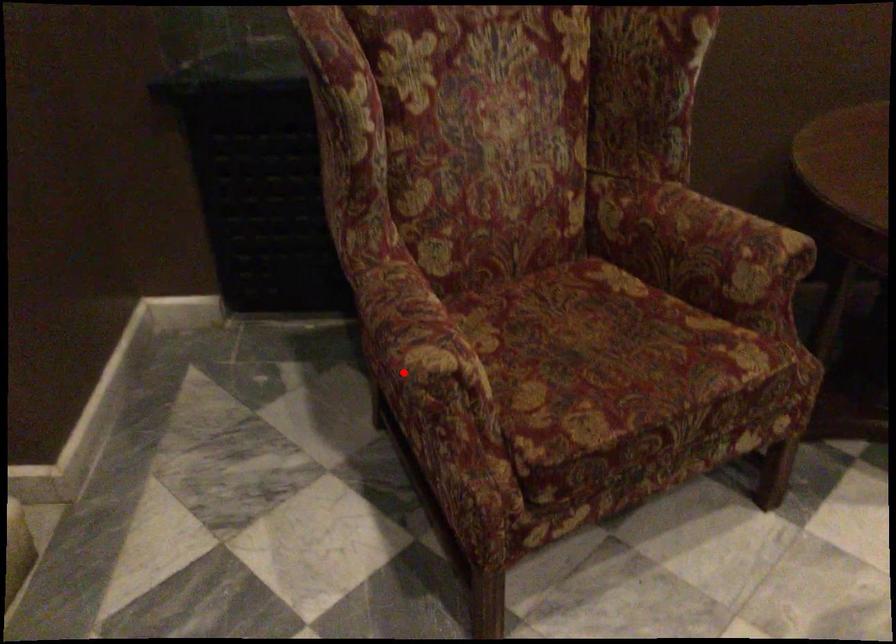
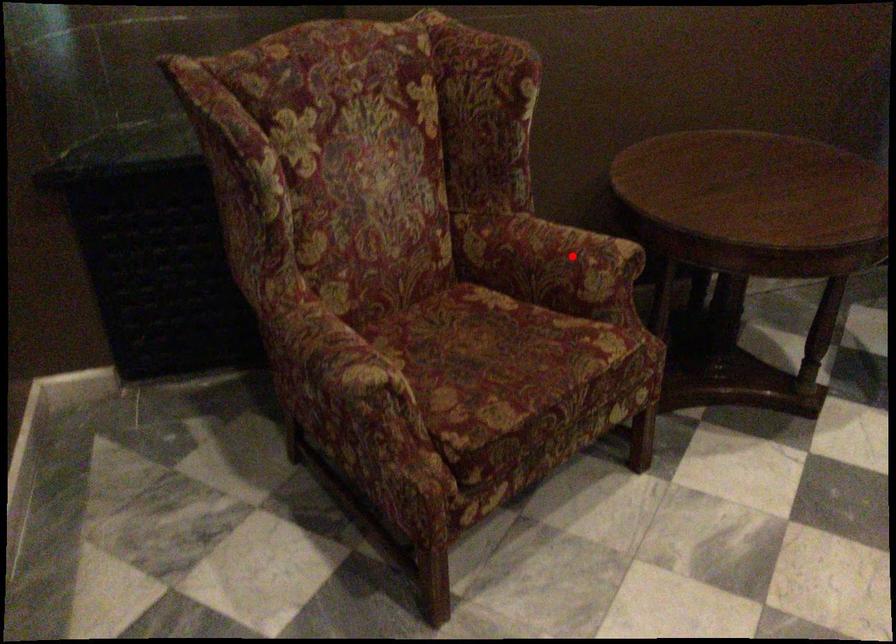
I am providing you with two images of the same scene from different viewpoints. A red point is marked on the first image and another point is marked on the second image. Does the point marked in image1 correspond to the same location as the one in image2?

No